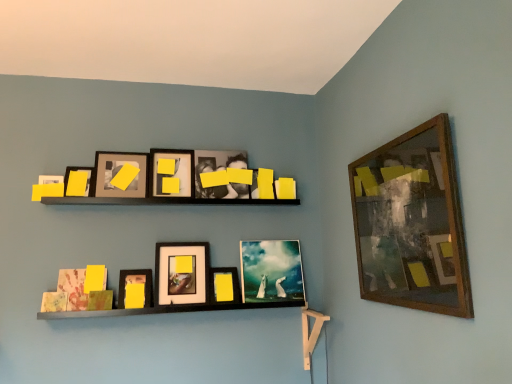
Describe the element at coordinates (271, 271) in the screenshot. I see `matte glass painting at center, the 8th picture frame in the left-to-right sequence` at that location.

Find the location of a particular element. The image size is (512, 384). wooden shelf at center is located at coordinates (215, 279).

Describe the element at coordinates (172, 172) in the screenshot. I see `matte black picture frame at upper center, the fourth picture frame in the left-to-right sequence` at that location.

The height and width of the screenshot is (384, 512). Identify the location of wooden-framed artwork at upper right, placed as the ninth picture frame when sorted from left to right. (412, 223).

What do you see at coordinates (181, 273) in the screenshot?
I see `matte black picture frame at center, which ranks as the 5th picture frame in left-to-right order` at bounding box center [181, 273].

The image size is (512, 384). What are the coordinates of `matte black picture frame at upper left, positioned as the 1th picture frame in left-to-right order` in the screenshot? It's located at (78, 181).

Considering the relative positions of matte black photo frame at upper center, placed as the fourth picture frame when sorted from right to left, and matte black picture frame at center, which ranks as the 5th picture frame in right-to-left order, in the image provided, is matte black photo frame at upper center, placed as the fourth picture frame when sorted from right to left, behind matte black picture frame at center, which ranks as the 5th picture frame in right-to-left order,?

Yes, it is behind matte black picture frame at center, which ranks as the 5th picture frame in right-to-left order.

Does matte black photo frame at upper center, placed as the fourth picture frame when sorted from right to left, touch matte black picture frame at center, which ranks as the 5th picture frame in right-to-left order?

No, matte black photo frame at upper center, placed as the fourth picture frame when sorted from right to left, is not next to matte black picture frame at center, which ranks as the 5th picture frame in right-to-left order.

From a real-world perspective, who is located lower, matte black photo frame at upper center, which appears as the 6th picture frame when viewed from the left, or matte black picture frame at center, which ranks as the 5th picture frame in right-to-left order?

matte black picture frame at center, which ranks as the 5th picture frame in right-to-left order, is physically lower.

Is point (210, 198) closer or farther from the camera than point (175, 270)?

Point (210, 198).

In the scene shown: Is matte black picture frame at upper left, which appears as the 8th picture frame when viewed from the right, outside of matte black picture frame at upper left, positioned as the 1th picture frame in left-to-right order?

matte black picture frame at upper left, which appears as the 8th picture frame when viewed from the right, lies outside matte black picture frame at upper left, positioned as the 1th picture frame in left-to-right order,'s area.

How many degrees apart are the facing directions of matte black picture frame at upper left, which appears as the 8th picture frame when viewed from the right, and matte black picture frame at upper left, positioned as the 1th picture frame in left-to-right order?

There is a 5.03-degree angle between the facing directions of matte black picture frame at upper left, which appears as the 8th picture frame when viewed from the right, and matte black picture frame at upper left, positioned as the 1th picture frame in left-to-right order.

From a real-world perspective, is matte black picture frame at upper left, which ranks as the second picture frame in left-to-right order, on matte black picture frame at upper left, positioned as the 1th picture frame in left-to-right order?

Yes, from a real-world perspective, matte black picture frame at upper left, which ranks as the second picture frame in left-to-right order, is above matte black picture frame at upper left, positioned as the 1th picture frame in left-to-right order.

Is point (121, 174) positioned before point (82, 180)?

No, (121, 174) is behind (82, 180).

Is yellow matte picture frame at center, which is counted as the seventh picture frame, starting from the left, not inside matte black picture frame at upper center, the 6th picture frame when ordered from right to left?

yellow matte picture frame at center, which is counted as the seventh picture frame, starting from the left, is positioned outside matte black picture frame at upper center, the 6th picture frame when ordered from right to left.

Locate an element on the screen. the 8th picture frame above the yellow matte picture frame at center, which is counted as the seventh picture frame, starting from the left (from the image's perspective) is located at coordinates (172, 172).

Is the depth of yellow matte picture frame at center, which appears as the third picture frame when viewed from the right, greater than that of matte black picture frame at upper center, the 6th picture frame when ordered from right to left?

Yes, yellow matte picture frame at center, which appears as the third picture frame when viewed from the right, is further from the viewer.

Is yellow matte picture frame at center, which appears as the third picture frame when viewed from the right, aimed at matte black picture frame at upper center, the fourth picture frame in the left-to-right sequence?

No.

From the picture: Is matte yellow paper at lower center, positioned as the 3th picture frame in left-to-right order, situated inside matte black picture frame at upper left, positioned as the 1th picture frame in left-to-right order, or outside?

matte yellow paper at lower center, positioned as the 3th picture frame in left-to-right order, exists outside the volume of matte black picture frame at upper left, positioned as the 1th picture frame in left-to-right order.

Is matte yellow paper at lower center, positioned as the 3th picture frame in left-to-right order, shorter than matte black picture frame at upper left, which is the 9th picture frame in right-to-left order?

No.

From the image's perspective, is matte yellow paper at lower center, positioned as the 3th picture frame in left-to-right order, positioned above or below matte black picture frame at upper left, positioned as the 1th picture frame in left-to-right order?

From the image's perspective, matte yellow paper at lower center, positioned as the 3th picture frame in left-to-right order, appears below matte black picture frame at upper left, positioned as the 1th picture frame in left-to-right order.

Which of these two, matte black picture frame at upper left, which appears as the 8th picture frame when viewed from the right, or matte black photo frame at upper center, placed as the fourth picture frame when sorted from right to left, is wider?

Wider between the two is matte black picture frame at upper left, which appears as the 8th picture frame when viewed from the right.

From the image's perspective, starting from the matte black picture frame at upper left, which appears as the 8th picture frame when viewed from the right, which picture frame is the 1st one above? Please provide its 2D coordinates.

[(220, 170)]

Is point (120, 191) farther from viewer compared to point (207, 189)?

No, (120, 191) is closer to viewer.

From a real-world perspective, which picture frame is the 4th one underneath the matte black photo frame at upper center, placed as the fourth picture frame when sorted from right to left? Please provide its 2D coordinates.

[(412, 223)]

Between matte black photo frame at upper center, placed as the fourth picture frame when sorted from right to left, and wooden-framed artwork at upper right, which appears as the 1th picture frame when viewed from the right, which one appears on the left side from the viewer's perspective?

Positioned to the left is matte black photo frame at upper center, placed as the fourth picture frame when sorted from right to left.

Would you say matte black photo frame at upper center, placed as the fourth picture frame when sorted from right to left, is inside or outside wooden-framed artwork at upper right, placed as the ninth picture frame when sorted from left to right?

matte black photo frame at upper center, placed as the fourth picture frame when sorted from right to left, is located beyond the bounds of wooden-framed artwork at upper right, placed as the ninth picture frame when sorted from left to right.

Is matte black photo frame at upper center, which appears as the 6th picture frame when viewed from the left, further to camera compared to wooden-framed artwork at upper right, which appears as the 1th picture frame when viewed from the right?

Yes, matte black photo frame at upper center, which appears as the 6th picture frame when viewed from the left, is behind wooden-framed artwork at upper right, which appears as the 1th picture frame when viewed from the right.

Considering the relative sizes of matte yellow paper at lower center, which ranks as the 7th picture frame in right-to-left order, and matte glass painting at center, which is the 2th picture frame in right-to-left order, in the image provided, is matte yellow paper at lower center, which ranks as the 7th picture frame in right-to-left order, taller than matte glass painting at center, which is the 2th picture frame in right-to-left order,?

In fact, matte yellow paper at lower center, which ranks as the 7th picture frame in right-to-left order, may be shorter than matte glass painting at center, which is the 2th picture frame in right-to-left order.

Does matte yellow paper at lower center, which ranks as the 7th picture frame in right-to-left order, turn towards matte glass painting at center, the 8th picture frame in the left-to-right sequence?

No, matte yellow paper at lower center, which ranks as the 7th picture frame in right-to-left order, does not turn towards matte glass painting at center, the 8th picture frame in the left-to-right sequence.

Is matte yellow paper at lower center, positioned as the 3th picture frame in left-to-right order, far away from matte glass painting at center, which is the 2th picture frame in right-to-left order?

They are positioned close to each other.

Is matte glass painting at center, the 8th picture frame in the left-to-right sequence, surrounded by matte yellow paper at lower center, positioned as the 3th picture frame in left-to-right order?

No, matte glass painting at center, the 8th picture frame in the left-to-right sequence, is not inside matte yellow paper at lower center, positioned as the 3th picture frame in left-to-right order.

You are a GUI agent. You are given a task and a screenshot of the screen. Output one action in this format:
    pyautogui.click(x=<x>, y=<y>)
    Task: Click on the 5th picture frame directly above the matte black picture frame at center, which ranks as the 5th picture frame in left-to-right order (from a real-world perspective)
    The image size is (512, 384).
    Given the screenshot: What is the action you would take?
    pyautogui.click(x=220, y=170)

I want to click on picture frame to the left of matte black picture frame at upper left, which ranks as the second picture frame in left-to-right order, so click(x=78, y=181).

Based on their spatial positions, is wooden-framed artwork at upper right, which appears as the 1th picture frame when viewed from the right, or matte black picture frame at upper left, which appears as the 8th picture frame when viewed from the right, further from matte black picture frame at upper center, the fourth picture frame in the left-to-right sequence?

wooden-framed artwork at upper right, which appears as the 1th picture frame when viewed from the right, lies further to matte black picture frame at upper center, the fourth picture frame in the left-to-right sequence, than the other object.

Looking at this image, estimate the real-world distances between objects in this image. Which object is further from matte black picture frame at upper center, the 6th picture frame when ordered from right to left, yellow matte picture frame at center, which is counted as the seventh picture frame, starting from the left, or matte black photo frame at upper center, which appears as the 6th picture frame when viewed from the left?

yellow matte picture frame at center, which is counted as the seventh picture frame, starting from the left, is further to matte black picture frame at upper center, the 6th picture frame when ordered from right to left.

Looking at the image, which one is located further to matte black picture frame at upper left, which is the 9th picture frame in right-to-left order, yellow matte picture frame at center, which appears as the third picture frame when viewed from the right, or matte black picture frame at upper center, the fourth picture frame in the left-to-right sequence?

Among the two, yellow matte picture frame at center, which appears as the third picture frame when viewed from the right, is located further to matte black picture frame at upper left, which is the 9th picture frame in right-to-left order.

Considering their positions, is matte black picture frame at center, which ranks as the 5th picture frame in left-to-right order, positioned further to wooden shelf at center than wooden-framed artwork at upper right, which appears as the 1th picture frame when viewed from the right?

wooden-framed artwork at upper right, which appears as the 1th picture frame when viewed from the right.

When comparing their distances from yellow matte picture frame at center, which is counted as the seventh picture frame, starting from the left, does matte black picture frame at center, which ranks as the 5th picture frame in left-to-right order, or matte yellow paper at lower center, positioned as the 3th picture frame in left-to-right order, seem further?

matte yellow paper at lower center, positioned as the 3th picture frame in left-to-right order.

From the image, which object appears to be farther from matte yellow paper at lower center, which ranks as the 7th picture frame in right-to-left order, wooden shelf at center or yellow matte picture frame at center, which appears as the third picture frame when viewed from the right?

yellow matte picture frame at center, which appears as the third picture frame when viewed from the right, lies further to matte yellow paper at lower center, which ranks as the 7th picture frame in right-to-left order, than the other object.

Looking at the image, which one is located closer to matte black picture frame at upper left, which ranks as the second picture frame in left-to-right order, matte yellow paper at lower center, positioned as the 3th picture frame in left-to-right order, or wooden shelf at center?

Based on the image, matte yellow paper at lower center, positioned as the 3th picture frame in left-to-right order, appears to be nearer to matte black picture frame at upper left, which ranks as the second picture frame in left-to-right order.

Estimate the real-world distances between objects in this image. Which object is closer to matte black picture frame at center, which ranks as the 5th picture frame in right-to-left order, matte glass painting at center, which is the 2th picture frame in right-to-left order, or matte black photo frame at upper center, which appears as the 6th picture frame when viewed from the left?

matte glass painting at center, which is the 2th picture frame in right-to-left order, is positioned closer to the anchor matte black picture frame at center, which ranks as the 5th picture frame in right-to-left order.

Locate an element on the screen. This screenshot has height=384, width=512. shelf that lies between matte black picture frame at upper center, the 6th picture frame when ordered from right to left, and matte black picture frame at center, which ranks as the 5th picture frame in right-to-left order, from top to bottom is located at coordinates (215, 279).

Locate an element on the screen. shelf between matte black picture frame at upper left, which ranks as the second picture frame in left-to-right order, and matte black picture frame at center, which ranks as the 5th picture frame in left-to-right order, from top to bottom is located at coordinates (215, 279).

Find the location of a particular element. This screenshot has height=384, width=512. shelf between matte yellow paper at lower center, positioned as the 3th picture frame in left-to-right order, and wooden-framed artwork at upper right, placed as the ninth picture frame when sorted from left to right is located at coordinates (215, 279).

Find the location of a particular element. Image resolution: width=512 pixels, height=384 pixels. shelf between matte yellow paper at lower center, which ranks as the 7th picture frame in right-to-left order, and yellow matte picture frame at center, which is counted as the seventh picture frame, starting from the left, in the horizontal direction is located at coordinates (215, 279).